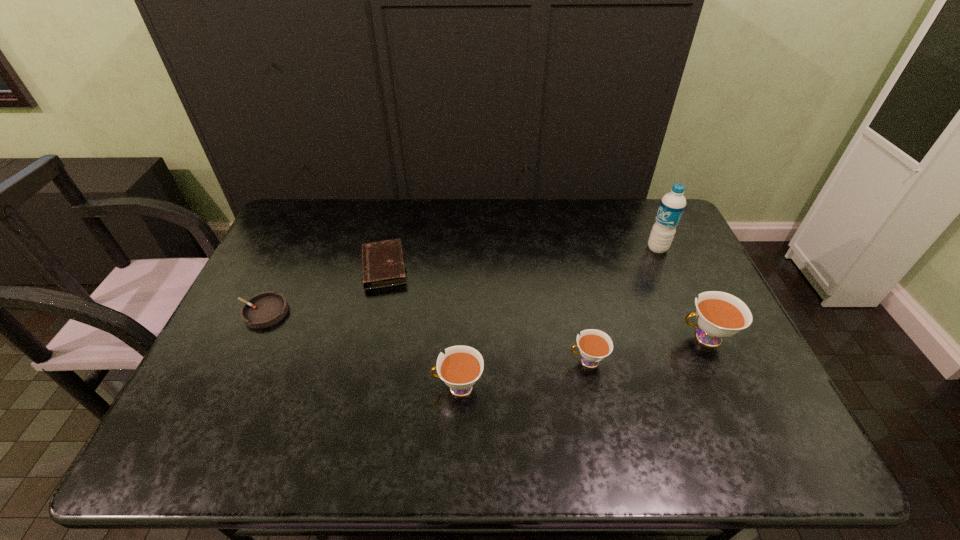
At what (x,y) coordinates should I click in order to perform the action: click on free space located on the label of the tallest object. Please return your answer as a coordinate pair (x, y). Image resolution: width=960 pixels, height=540 pixels. Looking at the image, I should click on (562, 248).

Where is `vacant space located 0.350m on the label of the tallest object`? The image size is (960, 540). vacant space located 0.350m on the label of the tallest object is located at coordinates (540, 248).

The image size is (960, 540). Identify the location of vacant area situated 0.110m on the label of the tallest object. click(613, 248).

Where is `object that is at the near edge`? The width and height of the screenshot is (960, 540). object that is at the near edge is located at coordinates (460, 368).

At what (x,y) coordinates should I click in order to perform the action: click on object situated at the left edge. Please return your answer as a coordinate pair (x, y). The width and height of the screenshot is (960, 540). Looking at the image, I should click on (265, 309).

Where is `teacup located at the right edge`? The height and width of the screenshot is (540, 960). teacup located at the right edge is located at coordinates (719, 315).

I want to click on water bottle present at the right edge, so click(672, 205).

Where is `free location at the far edge of the desktop`? free location at the far edge of the desktop is located at coordinates (573, 207).

This screenshot has width=960, height=540. In the image, there is a desktop. Identify the location of free space at the near edge. (535, 399).

Locate an element on the screen. free space at the left edge is located at coordinates tap(298, 248).